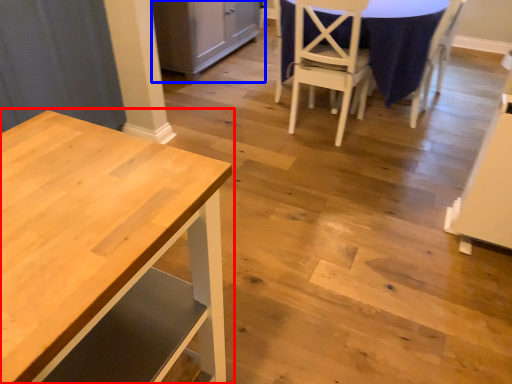
Question: Among these objects, which one is nearest to the camera, table (highlighted by a red box) or cabinetry (highlighted by a blue box)?

Choices:
 (A) table
 (B) cabinetry

Answer: (A)